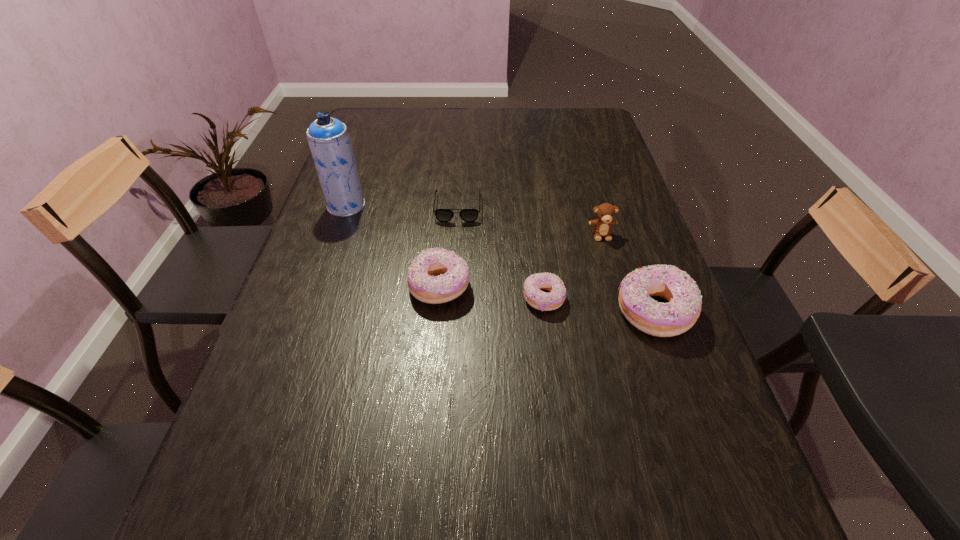
Where is `vacant region located 0.370m on the left of the shortest doughnut`? The image size is (960, 540). vacant region located 0.370m on the left of the shortest doughnut is located at coordinates (364, 299).

Locate an element on the screen. This screenshot has width=960, height=540. vacant space located on the left of the rightmost doughnut is located at coordinates (439, 312).

Find the location of a particular element. The width and height of the screenshot is (960, 540). vacant space located 0.240m on the face of the fourth nearest object is located at coordinates (624, 312).

Locate an element on the screen. free region located on the front-facing side of the spectacles is located at coordinates (455, 260).

Where is `vacant space located on the back of the tallest object`? This screenshot has height=540, width=960. vacant space located on the back of the tallest object is located at coordinates (360, 167).

Identify the location of object that is positioned at the left edge. (328, 138).

The height and width of the screenshot is (540, 960). I want to click on doughnut present at the right edge, so click(x=670, y=319).

You are a GUI agent. You are given a task and a screenshot of the screen. Output one action in this format:
    pyautogui.click(x=<x>, y=<y>)
    Task: Click on the teddy bear located in the right edge section of the desktop
    
    Given the screenshot: What is the action you would take?
    pyautogui.click(x=605, y=212)

Identify the location of free space at the far edge of the desktop. The height and width of the screenshot is (540, 960). (421, 132).

In the image, there is a desktop. Where is `blank space at the left edge`? This screenshot has height=540, width=960. blank space at the left edge is located at coordinates (290, 367).